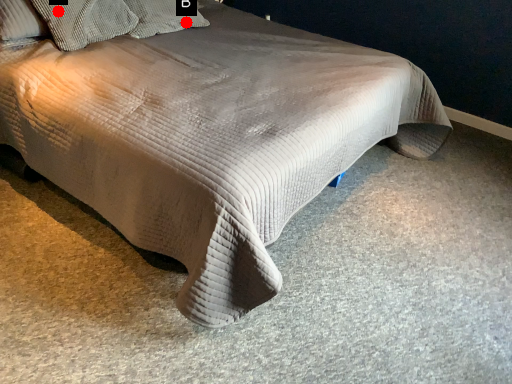
Question: Two points are circled on the image, labeled by A and B beside each circle. Which point is closer to the camera taking this photo?

Choices:
 (A) A is closer
 (B) B is closer

Answer: (A)